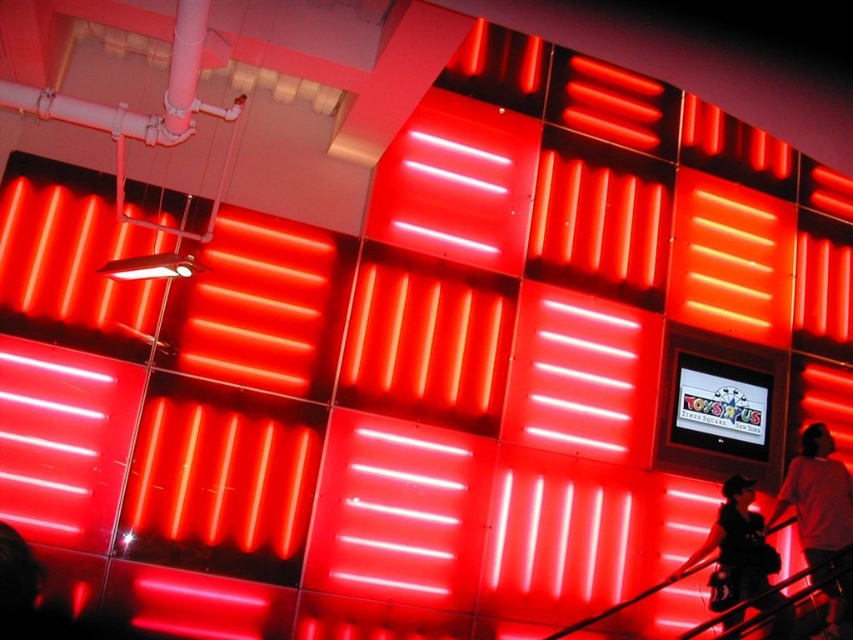
Is point (807, 456) farther from viewer compared to point (732, 624)?

Yes, it is.

Between point (813, 532) and point (759, 516), which one is positioned behind?

The point (759, 516) is more distant.

This screenshot has width=853, height=640. What are the coordinates of `white cotton shirt at lower right` in the screenshot? It's located at 821,518.